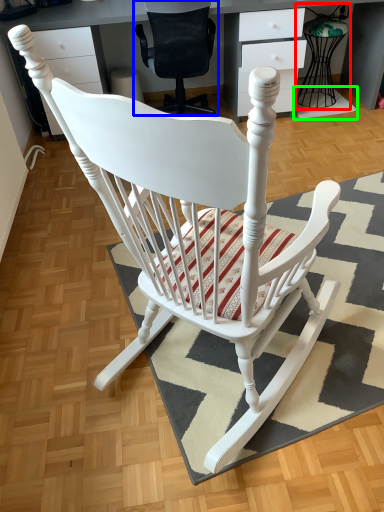
Question: Which is farther away from feeding chair (highlighted by a red box)? chair (highlighted by a blue box) or doormat (highlighted by a green box)?

Choices:
 (A) chair
 (B) doormat

Answer: (A)